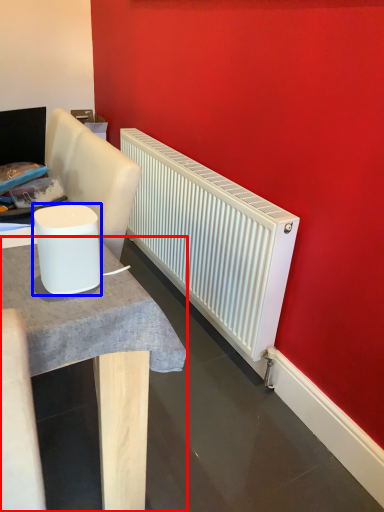
Question: Which of the following is the farthest to the observer, table (highlighted by a red box) or appliance (highlighted by a blue box)?

Choices:
 (A) table
 (B) appliance

Answer: (B)